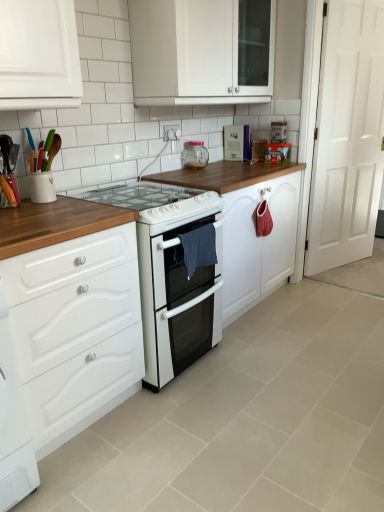
How much space does metallic silver book at upper center, which is the 3th appliance in front-to-back order, occupy horizontally?

metallic silver book at upper center, which is the 3th appliance in front-to-back order, is 13.14 centimeters wide.

Measure the distance between clear glass jar at upper center, arranged as the second appliance when viewed from the right, and camera.

clear glass jar at upper center, arranged as the second appliance when viewed from the right, is 2.72 meters from camera.

The width and height of the screenshot is (384, 512). Describe the element at coordinates (216, 252) in the screenshot. I see `white glossy cabinet at lower left, the first cabinetry when ordered from bottom to top` at that location.

Measure the distance between white glossy cabinet at upper center, which is the 1th cabinetry in top-to-bottom order, and camera.

The distance of white glossy cabinet at upper center, which is the 1th cabinetry in top-to-bottom order, from camera is 2.06 meters.

This screenshot has height=512, width=384. What do you see at coordinates (347, 136) in the screenshot? I see `white wooden door at right` at bounding box center [347, 136].

Describe the element at coordinates (173, 272) in the screenshot. The width and height of the screenshot is (384, 512). I see `white glossy electric stove at center, arranged as the 3th appliance when viewed from the right` at that location.

Where is `white glossy gas stove at center`? white glossy gas stove at center is located at coordinates (154, 202).

From a real-world perspective, does white glossy gas stove at center sit lower than metallic silver book at upper center, the first appliance when ordered from top to bottom?

Yes, from a real-world perspective, white glossy gas stove at center is under metallic silver book at upper center, the first appliance when ordered from top to bottom.

Which is closer, (x=130, y=191) or (x=239, y=133)?

Point (x=130, y=191).

From the image's perspective, who appears lower, white glossy gas stove at center or metallic silver book at upper center, which is the 3th appliance in front-to-back order?

white glossy gas stove at center.

The width and height of the screenshot is (384, 512). I want to click on appliance that is the 2nd object located above the white glossy gas stove at center (from the image's perspective), so click(236, 142).

Is white glossy electric stove at center, positioned as the 3th appliance in top-to-bottom order, in contact with metallic silver book at upper center, which appears as the 1th appliance when viewed from the back?

No, white glossy electric stove at center, positioned as the 3th appliance in top-to-bottom order, is not making contact with metallic silver book at upper center, which appears as the 1th appliance when viewed from the back.

Can you confirm if white glossy electric stove at center, positioned as the 3th appliance in top-to-bottom order, is thinner than metallic silver book at upper center, marked as the 1th appliance in a right-to-left arrangement?

No, white glossy electric stove at center, positioned as the 3th appliance in top-to-bottom order, is not thinner than metallic silver book at upper center, marked as the 1th appliance in a right-to-left arrangement.

Between white glossy electric stove at center, which is the first appliance in front-to-back order, and metallic silver book at upper center, which is the 3th appliance in front-to-back order, which one is positioned in front?

Positioned in front is white glossy electric stove at center, which is the first appliance in front-to-back order.

Can you confirm if white glossy electric stove at center, the 3th appliance in the back-to-front sequence, is bigger than metallic silver book at upper center, the first appliance when ordered from top to bottom?

Yes, white glossy electric stove at center, the 3th appliance in the back-to-front sequence, is bigger than metallic silver book at upper center, the first appliance when ordered from top to bottom.

Is white glossy gas stove at center not within white glossy electric stove at center, arranged as the 3th appliance when viewed from the right?

Yes, white glossy gas stove at center is located beyond the bounds of white glossy electric stove at center, arranged as the 3th appliance when viewed from the right.

Consider the image. Would you consider white glossy gas stove at center to be distant from white glossy electric stove at center, marked as the first appliance in a left-to-right arrangement?

No, white glossy gas stove at center is not far away from white glossy electric stove at center, marked as the first appliance in a left-to-right arrangement.

In terms of height, does white glossy gas stove at center look taller or shorter compared to white glossy electric stove at center, the 3th appliance in the back-to-front sequence?

Clearly, white glossy gas stove at center is shorter compared to white glossy electric stove at center, the 3th appliance in the back-to-front sequence.

Would you say white glossy gas stove at center is to the left or to the right of white glossy electric stove at center, positioned as the 3th appliance in top-to-bottom order, in the picture?

From the image, it's evident that white glossy gas stove at center is to the left of white glossy electric stove at center, positioned as the 3th appliance in top-to-bottom order.

Which object is positioned more to the right, metallic silver book at upper center, the first appliance when ordered from top to bottom, or white glossy cabinet at lower left, the first cabinetry when ordered from bottom to top?

metallic silver book at upper center, the first appliance when ordered from top to bottom, is more to the right.

Does metallic silver book at upper center, which is the 3th appliance in front-to-back order, turn towards white glossy cabinet at lower left, the first cabinetry when ordered from bottom to top?

No, metallic silver book at upper center, which is the 3th appliance in front-to-back order, is not facing towards white glossy cabinet at lower left, the first cabinetry when ordered from bottom to top.

Is point (242, 129) positioned behind point (48, 243)?

Yes, it is behind point (48, 243).

Is white glossy gas stove at center wider or thinner than white wooden door at right?

In the image, white glossy gas stove at center appears to be wider than white wooden door at right.

From the image's perspective, which is below, white glossy gas stove at center or white wooden door at right?

white glossy gas stove at center appears lower in the image.

From a real-world perspective, who is located higher, white glossy gas stove at center or white wooden door at right?

In real-world perspective, white wooden door at right is above.

Consider the image. From the image's perspective, is metallic silver book at upper center, which ranks as the 3th appliance in bottom-to-top order, located beneath white glossy cabinet at upper center, which is the 1th cabinetry in top-to-bottom order?

Yes.

At what (x,y) coordinates should I click in order to perform the action: click on appliance lying on the right of white glossy cabinet at upper center, which is the second cabinetry in bottom-to-top order. Please return your answer as a coordinate pair (x, y). The height and width of the screenshot is (512, 384). Looking at the image, I should click on pyautogui.click(x=236, y=142).

Does metallic silver book at upper center, marked as the 1th appliance in a right-to-left arrangement, appear on the left side of white glossy cabinet at upper center, which is the second cabinetry in bottom-to-top order?

No, metallic silver book at upper center, marked as the 1th appliance in a right-to-left arrangement, is not to the left of white glossy cabinet at upper center, which is the second cabinetry in bottom-to-top order.

Is metallic silver book at upper center, which appears as the 1th appliance when viewed from the back, thinner than white glossy cabinet at upper center, which is the 1th cabinetry in top-to-bottom order?

Indeed, metallic silver book at upper center, which appears as the 1th appliance when viewed from the back, has a lesser width compared to white glossy cabinet at upper center, which is the 1th cabinetry in top-to-bottom order.

Is point (52, 316) behind point (156, 369)?

No.

Can you confirm if white glossy cabinet at lower left, the 2th cabinetry from the top, is thinner than white glossy electric stove at center, the 3th appliance in the back-to-front sequence?

Incorrect, the width of white glossy cabinet at lower left, the 2th cabinetry from the top, is not less than that of white glossy electric stove at center, the 3th appliance in the back-to-front sequence.

From a real-world perspective, who is located lower, white glossy cabinet at lower left, the 2th cabinetry from the top, or white glossy electric stove at center, the 3th appliance in the back-to-front sequence?

white glossy cabinet at lower left, the 2th cabinetry from the top, is physically lower.

What are the coordinates of `gas stove that appears below the metallic silver book at upper center, which appears as the 1th appliance when viewed from the back (from a real-world perspective)` in the screenshot? It's located at (154, 202).

Locate an element on the screen. The height and width of the screenshot is (512, 384). appliance that is the 2nd one above the white glossy electric stove at center, marked as the first appliance in a left-to-right arrangement (from a real-world perspective) is located at coordinates (236, 142).

Estimate the real-world distances between objects in this image. Which object is closer to metallic silver book at upper center, the first appliance when ordered from top to bottom, white glossy electric stove at center, the first appliance when ordered from bottom to top, or white wooden door at right?

The object closer to metallic silver book at upper center, the first appliance when ordered from top to bottom, is white wooden door at right.

Based on the photo, which object lies nearer to the anchor point white glossy cabinet at lower left, the 2th cabinetry from the top, white glossy cabinet at upper center, which is the second cabinetry in bottom-to-top order, or white glossy electric stove at center, the 3th appliance in the back-to-front sequence?

white glossy electric stove at center, the 3th appliance in the back-to-front sequence, is positioned closer to the anchor white glossy cabinet at lower left, the 2th cabinetry from the top.

When comparing their distances from white glossy cabinet at lower left, the first cabinetry when ordered from bottom to top, does metallic silver book at upper center, the first appliance when ordered from top to bottom, or white glossy electric stove at center, which is the first appliance in front-to-back order, seem further?

Based on the image, metallic silver book at upper center, the first appliance when ordered from top to bottom, appears to be further to white glossy cabinet at lower left, the first cabinetry when ordered from bottom to top.

When comparing their distances from white glossy cabinet at lower left, the 2th cabinetry from the top, does white wooden door at right or white glossy electric stove at center, the first appliance when ordered from bottom to top, seem closer?

white glossy electric stove at center, the first appliance when ordered from bottom to top, is closer to white glossy cabinet at lower left, the 2th cabinetry from the top.

Estimate the real-world distances between objects in this image. Which object is closer to white glossy cabinet at lower left, the 2th cabinetry from the top, white glossy gas stove at center or metallic silver book at upper center, which appears as the 1th appliance when viewed from the back?

Based on the image, white glossy gas stove at center appears to be nearer to white glossy cabinet at lower left, the 2th cabinetry from the top.

Estimate the real-world distances between objects in this image. Which object is closer to white glossy gas stove at center, white wooden door at right or white glossy electric stove at center, which is the first appliance in front-to-back order?

Among the two, white glossy electric stove at center, which is the first appliance in front-to-back order, is located nearer to white glossy gas stove at center.

Looking at the image, which one is located further to clear glass jar at upper center, arranged as the second appliance when viewed from the right, white wooden door at right or white glossy electric stove at center, positioned as the 3th appliance in top-to-bottom order?

white wooden door at right.

When comparing their distances from clear glass jar at upper center, the second appliance positioned from the top, does white glossy gas stove at center or white glossy electric stove at center, the first appliance when ordered from bottom to top, seem closer?

The object closer to clear glass jar at upper center, the second appliance positioned from the top, is white glossy gas stove at center.

Locate an element on the screen. The image size is (384, 512). door that lies between white glossy cabinet at upper center, which is the 1th cabinetry in top-to-bottom order, and white glossy cabinet at lower left, the 2th cabinetry from the top, from top to bottom is located at coordinates (347, 136).

This screenshot has width=384, height=512. What are the coordinates of `gas stove between white glossy cabinet at upper center, which is the 1th cabinetry in top-to-bottom order, and white glossy electric stove at center, which is the first appliance in front-to-back order, in the up-down direction` in the screenshot? It's located at (154, 202).

In order to click on cabinetry positioned between white glossy cabinet at lower left, the 2th cabinetry from the top, and metallic silver book at upper center, which appears as the 1th appliance when viewed from the back, from near to far in this screenshot , I will do `click(202, 51)`.

Find the location of `appliance between white glossy cabinet at upper center, which is the second cabinetry in bottom-to-top order, and white wooden door at right from left to right`. appliance between white glossy cabinet at upper center, which is the second cabinetry in bottom-to-top order, and white wooden door at right from left to right is located at coordinates (236, 142).